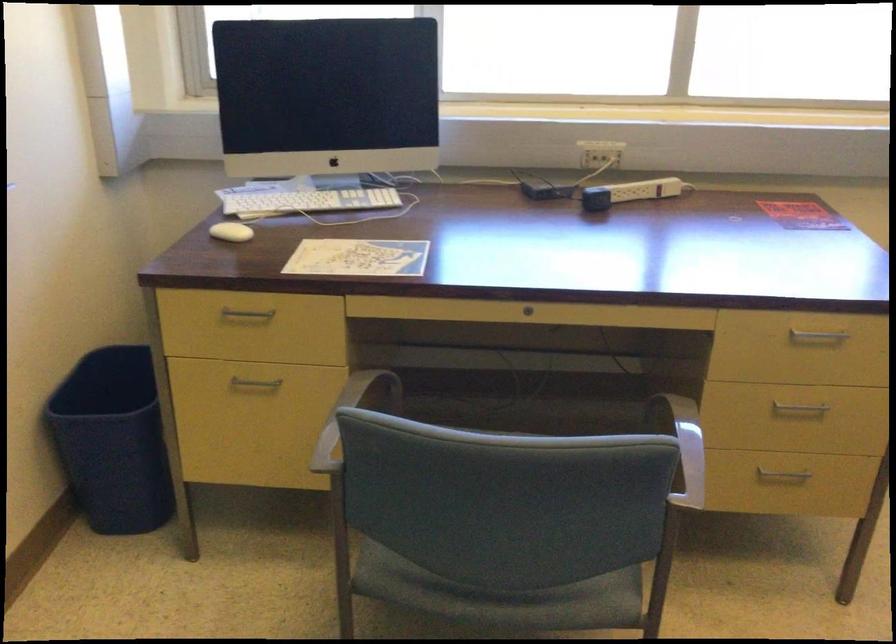
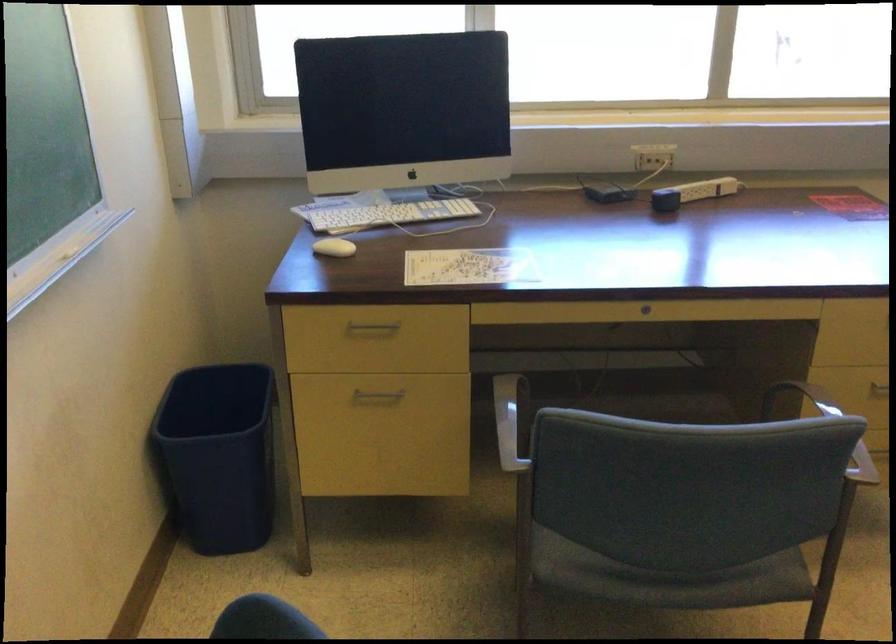
In the second image, find the point that corresponds to pixel 348 422 in the first image.

(511, 421)